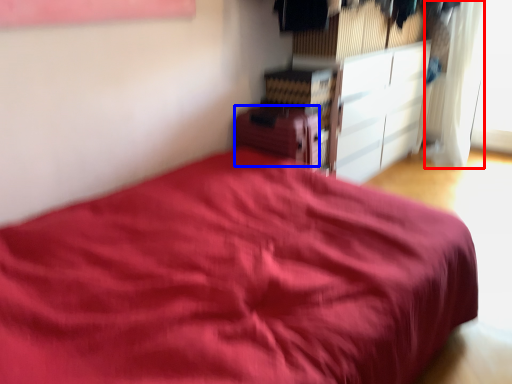
Question: Which of the following is the closest to the observer, curtain (highlighted by a red box) or cabinetry (highlighted by a blue box)?

Choices:
 (A) curtain
 (B) cabinetry

Answer: (B)